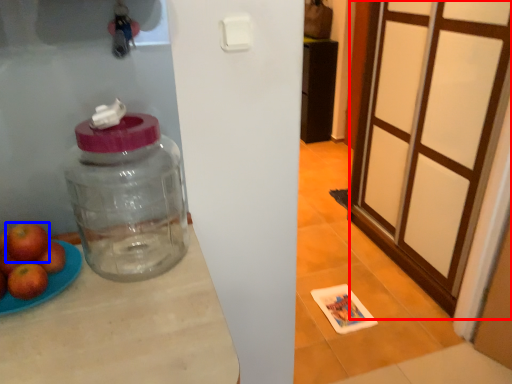
Question: Which object is further to the camera taking this photo, screen door (highlighted by a red box) or apple (highlighted by a blue box)?

Choices:
 (A) screen door
 (B) apple

Answer: (A)